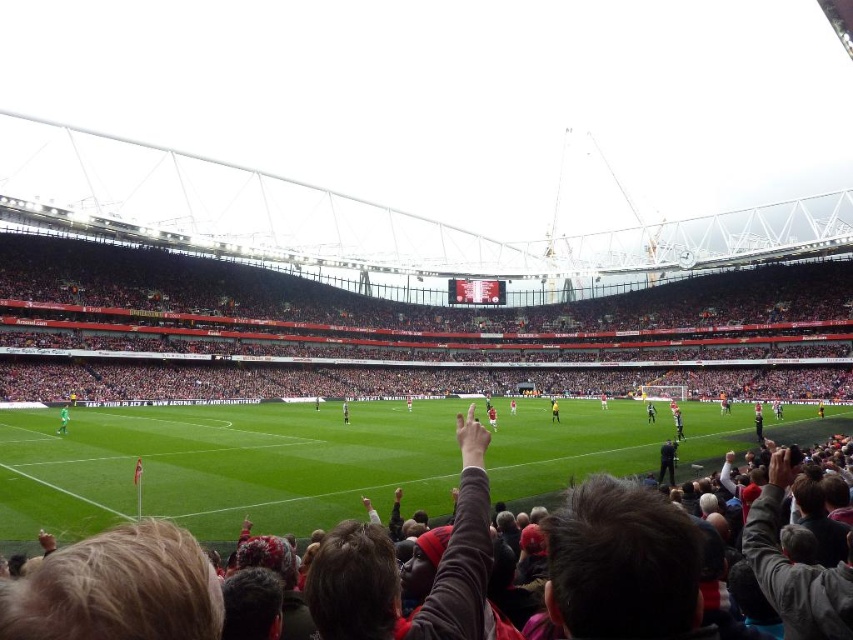
Looking at this image, you are a drone operator trying to capture aerial footage of the football match. Your drone is currently positioned above the green grass football field at center. You need to adjust your camera to focus on the yellow jersey at center. In which direction should you move the camera relative to the current position?

The green grass football field at center is to the left of the yellow jersey at center, so you should move the camera to the right to focus on the yellow jersey at center.